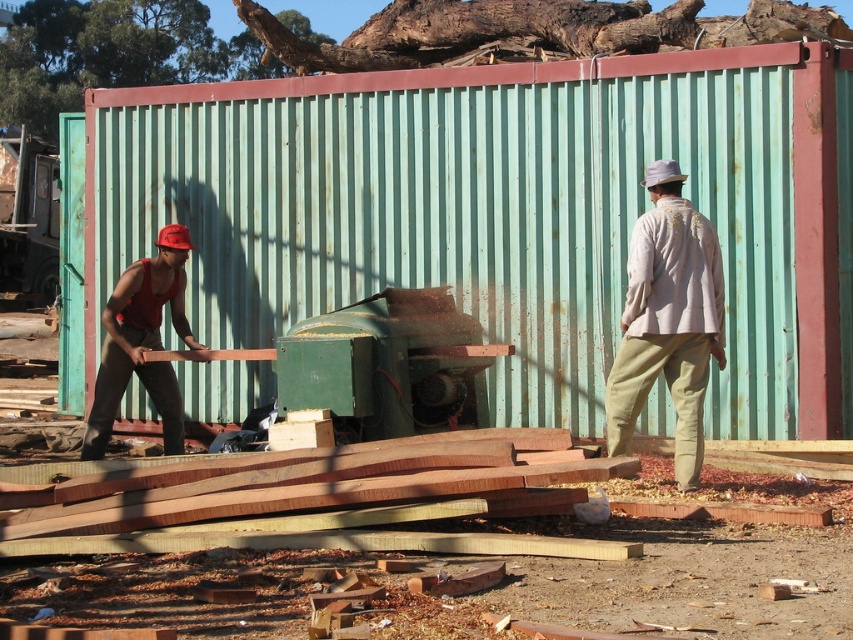
Question: Is light beige cotton shirt at center below red matte tank top at left?

Choices:
 (A) no
 (B) yes

Answer: (A)

Question: In this image, where is light beige cotton shirt at center located relative to red matte tank top at left?

Choices:
 (A) right
 (B) left

Answer: (A)

Question: Which of the following is the farthest from the observer?

Choices:
 (A) red matte tank top at left
 (B) light beige cotton shirt at center

Answer: (A)

Question: Can you confirm if light beige cotton shirt at center is positioned to the right of red matte tank top at left?

Choices:
 (A) yes
 (B) no

Answer: (A)